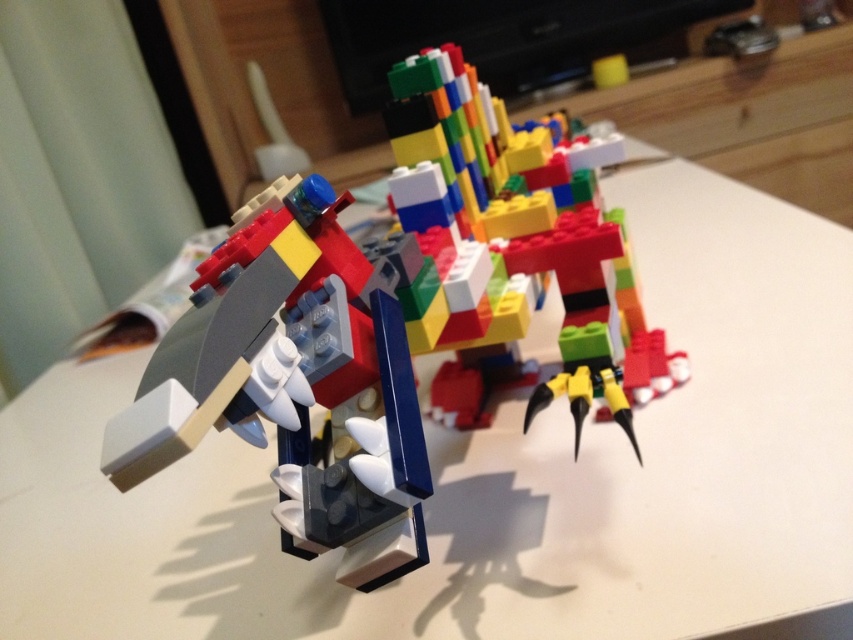
Question: Is matte plastic lego dragon at center smaller than multicolored plastic blocks at center?

Choices:
 (A) yes
 (B) no

Answer: (A)

Question: Is matte plastic lego dragon at center to the left of multicolored plastic blocks at center from the viewer's perspective?

Choices:
 (A) yes
 (B) no

Answer: (A)

Question: Among these objects, which one is nearest to the camera?

Choices:
 (A) multicolored plastic blocks at center
 (B) matte plastic lego dragon at center

Answer: (B)

Question: Which object appears farthest from the camera in this image?

Choices:
 (A) matte plastic lego dragon at center
 (B) multicolored plastic blocks at center

Answer: (B)

Question: Is matte plastic lego dragon at center to the right of multicolored plastic blocks at center from the viewer's perspective?

Choices:
 (A) yes
 (B) no

Answer: (B)